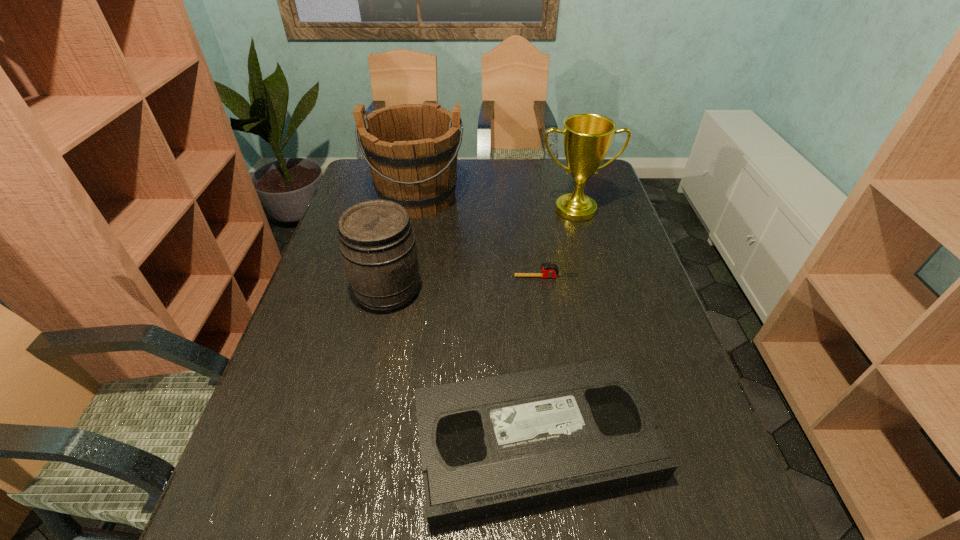
Identify which object is located as the nearest to the tape measure. Please provide its 2D coordinates. Your answer should be formatted as a tuple, i.e. [(x, y)], where the tuple contains the x and y coordinates of a point satisfying the conditions above.

[(587, 138)]

Where is `object that stands as the second closest to the third shortest object`? This screenshot has width=960, height=540. object that stands as the second closest to the third shortest object is located at coordinates (411, 149).

The image size is (960, 540). I want to click on vacant region that satisfies the following two spatial constraints: 1. on the side of the videotape with the handle for carrying; 2. on the right side of the farther wine bucket, so click(x=372, y=440).

Locate an element on the screen. The width and height of the screenshot is (960, 540). blank area in the image that satisfies the following two spatial constraints: 1. on the side of the tape measure with the handle for carrying; 2. on the right side of the farther wine bucket is located at coordinates (403, 277).

Where is `free space that satisfies the following two spatial constraints: 1. on the side of the farther wine bucket with the handle for carrying; 2. on the right side of the tape measure`? free space that satisfies the following two spatial constraints: 1. on the side of the farther wine bucket with the handle for carrying; 2. on the right side of the tape measure is located at coordinates (403, 277).

You are a GUI agent. You are given a task and a screenshot of the screen. Output one action in this format:
    pyautogui.click(x=<x>, y=<y>)
    Task: Click on the vacant region that satisfies the following two spatial constraints: 1. on the side of the tape measure with the handle for carrying; 2. on the left side of the farther wine bucket
    Image resolution: width=960 pixels, height=540 pixels.
    Given the screenshot: What is the action you would take?
    pyautogui.click(x=403, y=277)

At what (x,y) coordinates should I click in order to perform the action: click on free point that satisfies the following two spatial constraints: 1. on the back side of the tape measure; 2. on the left side of the shorter wine bucket. Please return your answer as a coordinate pair (x, y). Looking at the image, I should click on (391, 277).

Find the location of `vacant point that satisfies the following two spatial constraints: 1. on the back side of the tape measure; 2. on the right side of the shorter wine bucket`. vacant point that satisfies the following two spatial constraints: 1. on the back side of the tape measure; 2. on the right side of the shorter wine bucket is located at coordinates (391, 277).

In order to click on vacant position in the image that satisfies the following two spatial constraints: 1. on the side of the tape measure with the handle for carrying; 2. on the right side of the taller wine bucket in this screenshot , I will do `click(403, 277)`.